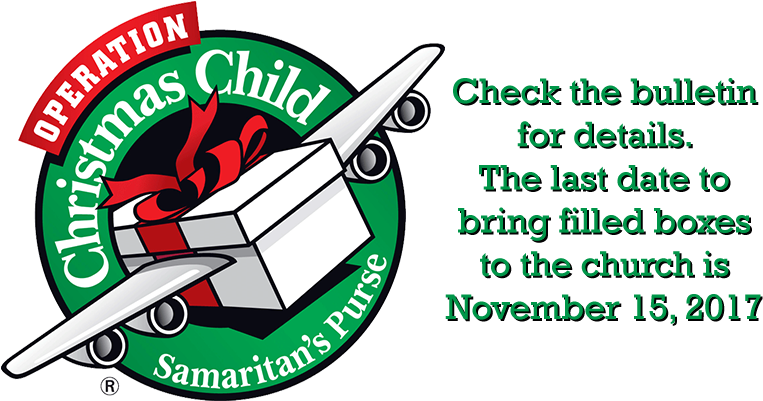
You are a GUI agent. You are given a task and a screenshot of the screen. Output one action in this format:
    pyautogui.click(x=<x>, y=<y>)
    Task: Click on the base of box
    The height and width of the screenshot is (401, 763).
    Given the screenshot: What is the action you would take?
    pyautogui.click(x=303, y=247)